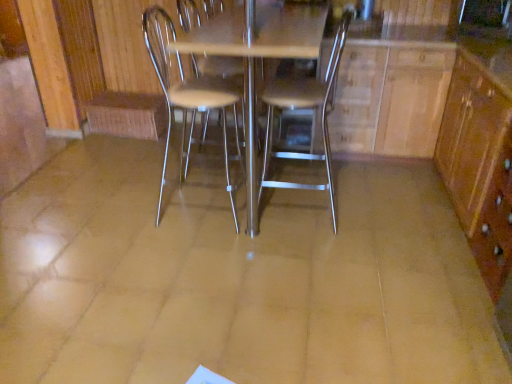
Question: Are wooden dresser at center and brown wood/file cabinet at right located far from each other?

Choices:
 (A) yes
 (B) no

Answer: (B)

Question: Is wooden dresser at center facing away from brown wood/file cabinet at right?

Choices:
 (A) no
 (B) yes

Answer: (B)

Question: From the image's perspective, is wooden dresser at center below brown wood/file cabinet at right?

Choices:
 (A) no
 (B) yes

Answer: (A)

Question: Considering the relative sizes of wooden dresser at center and brown wood/file cabinet at right in the image provided, is wooden dresser at center wider than brown wood/file cabinet at right?

Choices:
 (A) no
 (B) yes

Answer: (B)

Question: Could brown wood/file cabinet at right be considered to be inside wooden dresser at center?

Choices:
 (A) yes
 (B) no

Answer: (A)

Question: Looking at the image, does metallic silver chair at center, placed as the second chair when sorted from left to right, seem bigger or smaller compared to metallic silver table at center?

Choices:
 (A) big
 (B) small

Answer: (B)

Question: Visually, is metallic silver chair at center, the 1th chair viewed from the right, positioned to the left or to the right of metallic silver table at center?

Choices:
 (A) right
 (B) left

Answer: (A)

Question: From the image's perspective, is metallic silver chair at center, the 1th chair viewed from the right, located above or below metallic silver table at center?

Choices:
 (A) above
 (B) below

Answer: (B)

Question: From a real-world perspective, is metallic silver chair at center, placed as the second chair when sorted from left to right, positioned above or below metallic silver table at center?

Choices:
 (A) below
 (B) above

Answer: (B)

Question: From a real-world perspective, is brown wood/file cabinet at right physically located above or below wooden dresser at center?

Choices:
 (A) above
 (B) below

Answer: (A)

Question: From the image's perspective, is brown wood/file cabinet at right located above or below wooden dresser at center?

Choices:
 (A) below
 (B) above

Answer: (A)

Question: Considering the positions of brown wood/file cabinet at right and wooden dresser at center in the image, is brown wood/file cabinet at right taller or shorter than wooden dresser at center?

Choices:
 (A) short
 (B) tall

Answer: (A)

Question: Does point (479, 210) appear closer or farther from the camera than point (260, 21)?

Choices:
 (A) farther
 (B) closer

Answer: (B)

Question: Considering the positions of point (479, 127) and point (305, 14), is point (479, 127) closer or farther from the camera than point (305, 14)?

Choices:
 (A) closer
 (B) farther

Answer: (B)

Question: In the image, is brown wood/file cabinet at right positioned in front of or behind metallic silver table at center?

Choices:
 (A) behind
 (B) front

Answer: (B)